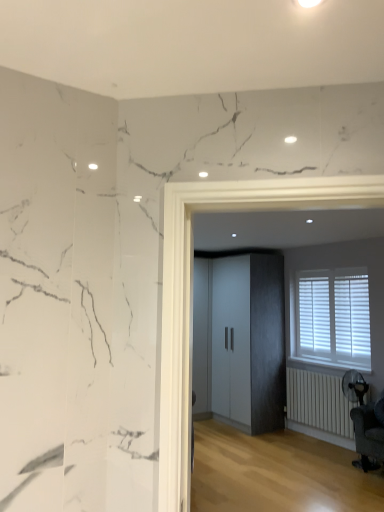
Question: In the image, is matte gray cabinet at center on the left side or the right side of white matte radiator at lower right?

Choices:
 (A) left
 (B) right

Answer: (A)

Question: Considering their positions, is matte gray cabinet at center located in front of or behind white matte radiator at lower right?

Choices:
 (A) behind
 (B) front

Answer: (A)

Question: Based on their relative distances, which object is farther from the white wood blinds at right?

Choices:
 (A) white matte radiator at lower right
 (B) matte gray cabinet at center
 (C) dark gray fabric swivel chair at lower right

Answer: (C)

Question: Which of these objects is positioned closest to the white wood blinds at right?

Choices:
 (A) dark gray fabric swivel chair at lower right
 (B) white matte radiator at lower right
 (C) matte gray cabinet at center

Answer: (B)